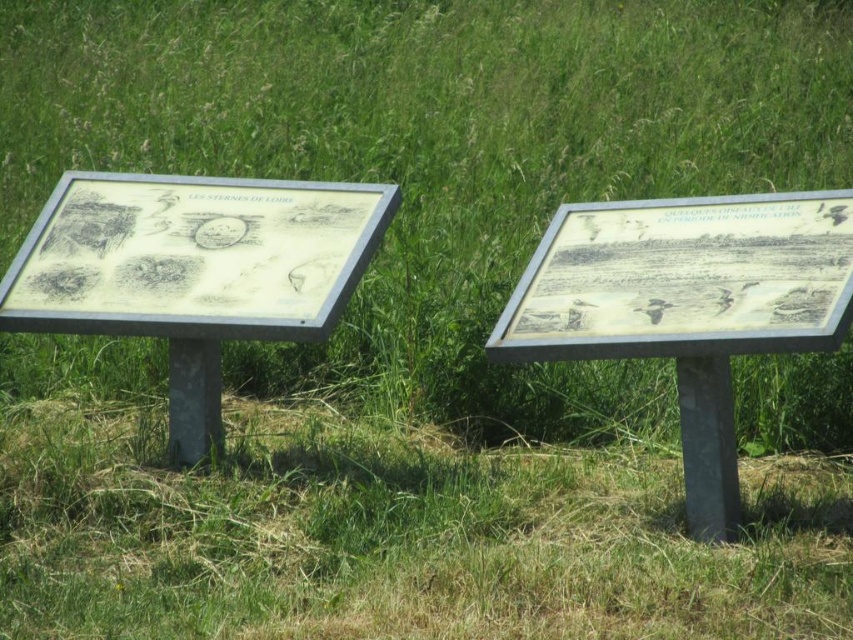
Question: Considering the relative positions of matte paper sign at left and matte silver sign at right in the image provided, where is matte paper sign at left located with respect to matte silver sign at right?

Choices:
 (A) right
 (B) left

Answer: (B)

Question: Can you confirm if matte paper sign at left is positioned to the right of matte silver sign at right?

Choices:
 (A) yes
 (B) no

Answer: (B)

Question: Does matte paper sign at left appear on the right side of matte silver sign at right?

Choices:
 (A) no
 (B) yes

Answer: (A)